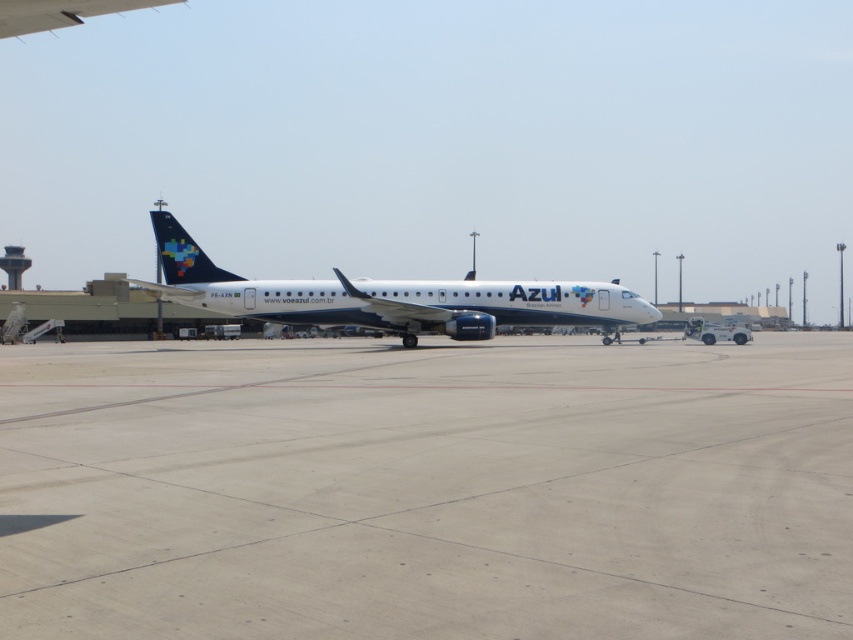
Is smooth concrete tarmac at center bigger than white glossy airplane at center?

No.

In the scene shown: Is smooth concrete tarmac at center below white glossy airplane at center?

Yes, smooth concrete tarmac at center is below white glossy airplane at center.

This screenshot has width=853, height=640. What do you see at coordinates (426, 490) in the screenshot? I see `smooth concrete tarmac at center` at bounding box center [426, 490].

Where is `smooth concrete tarmac at center`? smooth concrete tarmac at center is located at coordinates (426, 490).